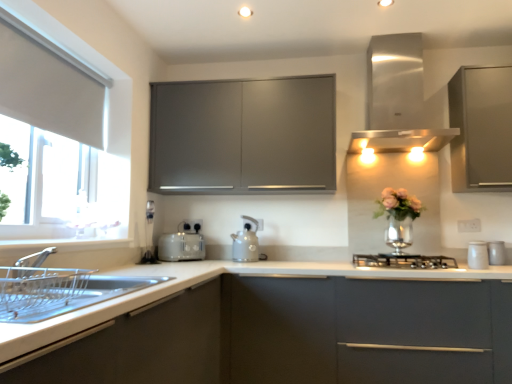
Question: In terms of width, does stainless steel vent at upper right look wider or thinner when compared to white fabric at left?

Choices:
 (A) thin
 (B) wide

Answer: (B)

Question: From a real-world perspective, is stainless steel vent at upper right positioned above or below white fabric at left?

Choices:
 (A) above
 (B) below

Answer: (A)

Question: Which is nearer to the matte gray cabinet at center, the first cabinetry positioned from the back?

Choices:
 (A) white matte countertop at center
 (B) matte gray kettle at center
 (C) matte gray cabinet at upper right, the 2th cabinetry viewed from the front
 (D) white fabric window at left
 (E) white fabric at left

Answer: (B)

Question: Which object is the closest to the white fabric at left?

Choices:
 (A) matte gray cabinet at upper right, the second cabinetry when ordered from back to front
 (B) white glossy canister at right, the 3th appliance from the left
 (C) white fabric window at left
 (D) satin grey toaster at center, which is the first appliance in back-to-front order
 (E) white ceramic jar at right, which is the 1th appliance in front-to-back order

Answer: (C)